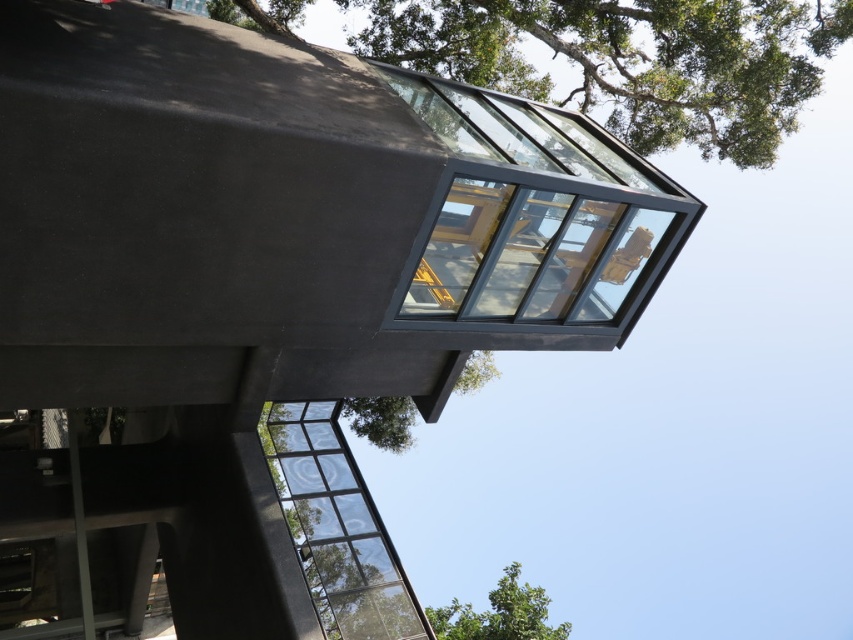
Question: Among these objects, which one is farthest from the camera?

Choices:
 (A) green leafy tree at upper center
 (B) clear glass window at lower left

Answer: (A)

Question: Does green leafy tree at upper center have a smaller size compared to clear glass window at lower left?

Choices:
 (A) yes
 (B) no

Answer: (B)

Question: Is the position of green leafy tree at upper center more distant than that of clear glass window at lower left?

Choices:
 (A) no
 (B) yes

Answer: (B)

Question: Is green leafy tree at upper center bigger than green leafy tree at upper right?

Choices:
 (A) no
 (B) yes

Answer: (B)

Question: Among these objects, which one is nearest to the camera?

Choices:
 (A) green leafy tree at upper center
 (B) green leafy tree at upper right
 (C) clear glass window at lower left

Answer: (C)

Question: Which point is farther from the camera taking this photo?

Choices:
 (A) (637, 60)
 (B) (540, 593)
 (C) (289, 433)

Answer: (B)